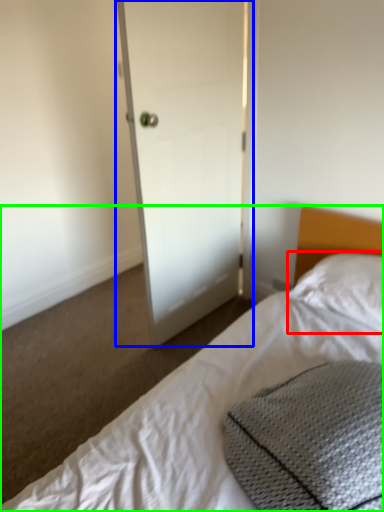
Question: Which object is the farthest from pillow (highlighted by a red box)? Choose among these: door (highlighted by a blue box) or bed (highlighted by a green box).

Choices:
 (A) door
 (B) bed

Answer: (A)